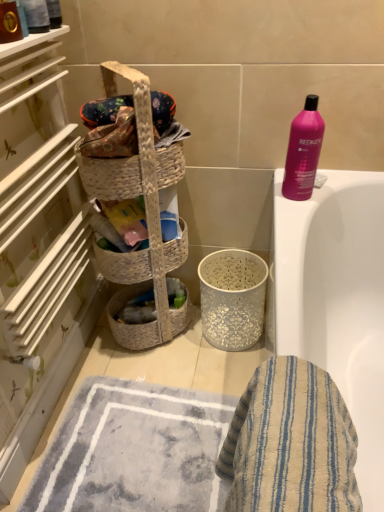
Question: Is blue striped cloth at lower right facing away from pink glossy shampoo at upper right?

Choices:
 (A) yes
 (B) no

Answer: (B)

Question: Can you confirm if blue striped cloth at lower right is smaller than pink glossy shampoo at upper right?

Choices:
 (A) yes
 (B) no

Answer: (B)

Question: From a real-world perspective, is blue striped cloth at lower right under pink glossy shampoo at upper right?

Choices:
 (A) no
 (B) yes

Answer: (B)

Question: Does blue striped cloth at lower right come in front of pink glossy shampoo at upper right?

Choices:
 (A) no
 (B) yes

Answer: (B)

Question: Is blue striped cloth at lower right facing towards pink glossy shampoo at upper right?

Choices:
 (A) no
 (B) yes

Answer: (A)

Question: Looking at the image, does pink glossy shampoo at upper right seem bigger or smaller compared to woven natural picnic basket at center?

Choices:
 (A) big
 (B) small

Answer: (B)

Question: Does point (302, 183) appear closer or farther from the camera than point (117, 198)?

Choices:
 (A) closer
 (B) farther

Answer: (A)

Question: Considering their positions, is pink glossy shampoo at upper right located in front of or behind woven natural picnic basket at center?

Choices:
 (A) behind
 (B) front

Answer: (A)

Question: From a real-world perspective, is pink glossy shampoo at upper right above or below woven natural picnic basket at center?

Choices:
 (A) below
 (B) above

Answer: (A)

Question: Relative to woven basket at left, is woven beige laundry basket at left in front or behind?

Choices:
 (A) front
 (B) behind

Answer: (B)

Question: Based on their sizes in the image, would you say woven beige laundry basket at left is bigger or smaller than woven basket at left?

Choices:
 (A) small
 (B) big

Answer: (B)

Question: Is point (162, 289) positioned closer to the camera than point (29, 57)?

Choices:
 (A) farther
 (B) closer

Answer: (A)

Question: Do you think woven beige laundry basket at left is within woven basket at left, or outside of it?

Choices:
 (A) outside
 (B) inside

Answer: (A)

Question: Considering the positions of point (162, 312) and point (160, 464), is point (162, 312) closer or farther from the camera than point (160, 464)?

Choices:
 (A) closer
 (B) farther

Answer: (B)

Question: Considering the positions of woven beige laundry basket at left and gray textured bath mat at lower center in the image, is woven beige laundry basket at left bigger or smaller than gray textured bath mat at lower center?

Choices:
 (A) small
 (B) big

Answer: (B)